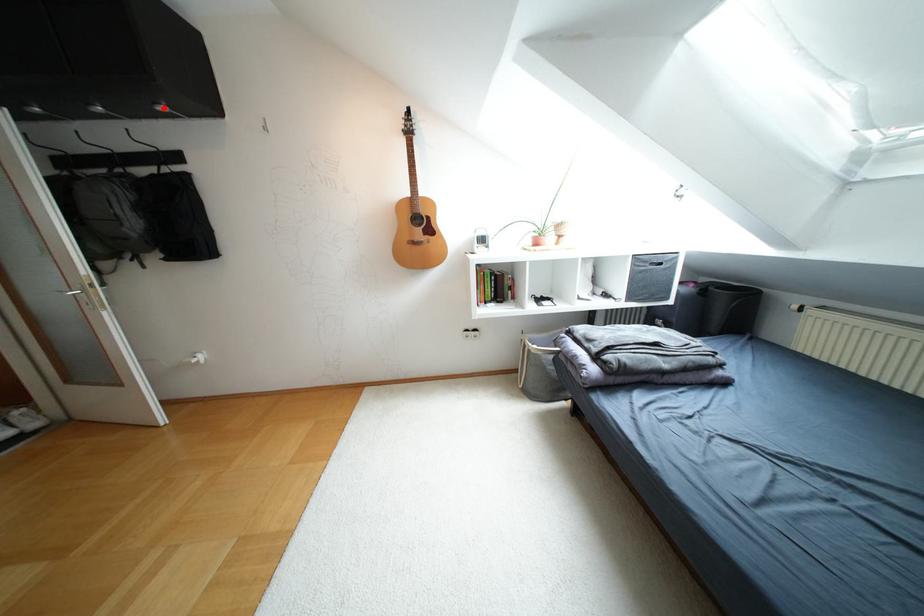
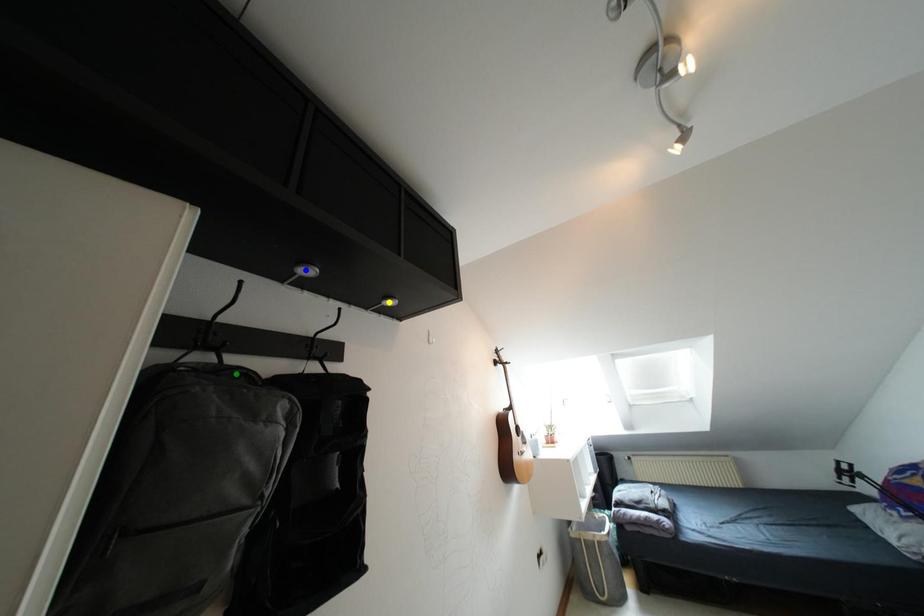
Question: I am providing you with two images of the same scene from different viewpoints. A red point is marked on the first image. You are given multiple points on the second image. Which mark in image 2 goes with the point in image 1?

Choices:
 (A) blue point
 (B) yellow point
 (C) green point

Answer: (B)